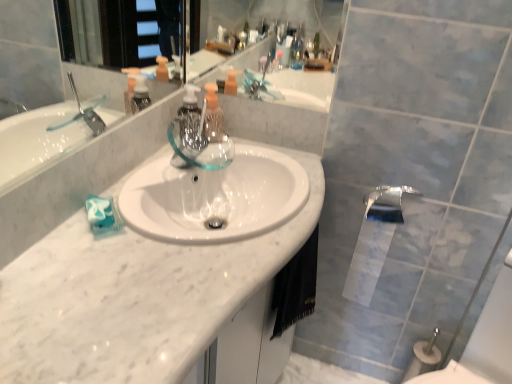
Locate an element on the screen. empty space that is to the right of translucent plastic soap dispenser at center is located at coordinates (250, 152).